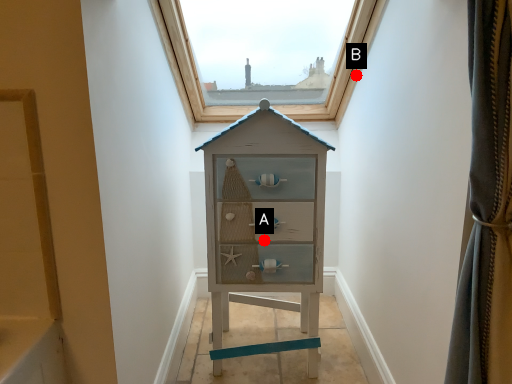
Question: Two points are circled on the image, labeled by A and B beside each circle. Which of the following is the closest to the observer?

Choices:
 (A) A is closer
 (B) B is closer

Answer: (A)